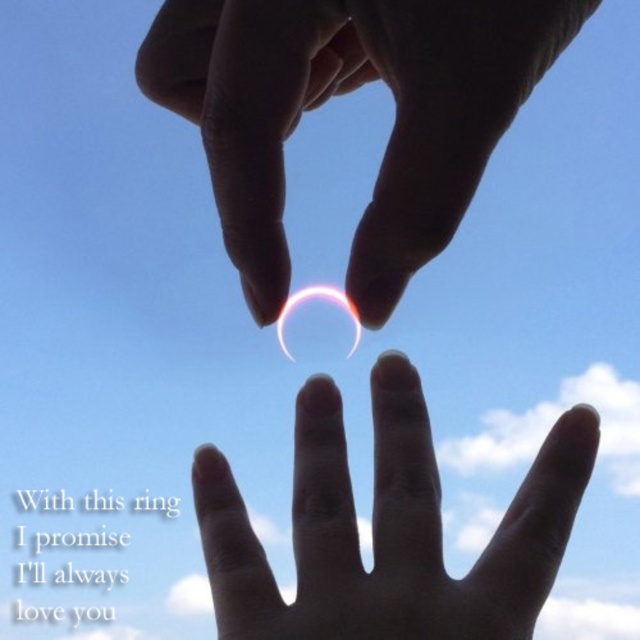
Question: Estimate the real-world distances between objects in this image. Which object is farther from the smooth skin hand at center?

Choices:
 (A) translucent glass heart at center
 (B) silvery metallic ring at center

Answer: (B)

Question: Does silvery metallic ring at center have a smaller size compared to smooth skin hand at center?

Choices:
 (A) yes
 (B) no

Answer: (B)

Question: Considering the real-world distances, which object is farthest from the smooth skin hand at center?

Choices:
 (A) translucent glass heart at center
 (B) silvery metallic ring at center

Answer: (B)

Question: Does smooth skin hand at center appear over translucent glass heart at center?

Choices:
 (A) yes
 (B) no

Answer: (B)

Question: Is silvery metallic ring at center wider than translucent glass heart at center?

Choices:
 (A) yes
 (B) no

Answer: (A)

Question: Which point is farther to the camera?

Choices:
 (A) silvery metallic ring at center
 (B) smooth skin hand at center
 (C) translucent glass heart at center

Answer: (B)